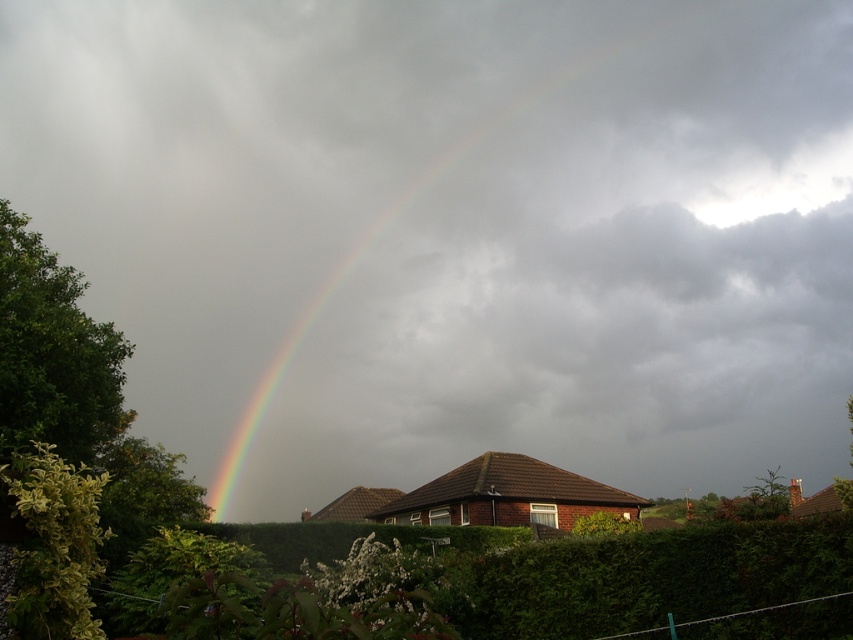
Is rainbow at upper center above green leafy hedge at lower left?

Indeed, rainbow at upper center is positioned over green leafy hedge at lower left.

Between point (508, 134) and point (64, 476), which one is positioned in front?

Positioned in front is point (64, 476).

Where is `rainbow at upper center`? This screenshot has width=853, height=640. rainbow at upper center is located at coordinates 476,236.

Between green leafy hedge at lower center and green leafy hedge at lower left, which one has less height?

Standing shorter between the two is green leafy hedge at lower left.

Which is in front, point (520, 572) or point (35, 548)?

Point (35, 548)

Locate an element on the screen. The width and height of the screenshot is (853, 640). green leafy hedge at lower center is located at coordinates (654, 577).

Between rainbow at upper center and green leafy hedge at left, which one has less height?

green leafy hedge at left is shorter.

You are a GUI agent. You are given a task and a screenshot of the screen. Output one action in this format:
    pyautogui.click(x=<x>, y=<y>)
    Task: Click on the rainbow at upper center
    The height and width of the screenshot is (640, 853).
    Given the screenshot: What is the action you would take?
    pyautogui.click(x=476, y=236)

The width and height of the screenshot is (853, 640). What do you see at coordinates (476, 236) in the screenshot? I see `rainbow at upper center` at bounding box center [476, 236].

Where is `rainbow at upper center`? This screenshot has width=853, height=640. rainbow at upper center is located at coordinates (476, 236).